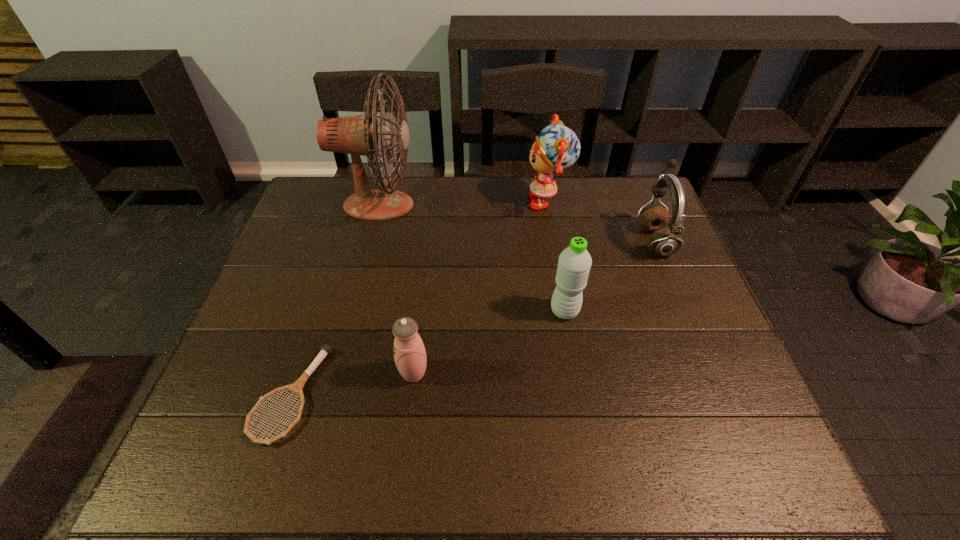
Identify the location of object at the near edge. (296, 387).

This screenshot has height=540, width=960. I want to click on fan at the left edge, so click(357, 135).

Locate an element on the screen. This screenshot has height=540, width=960. tennis racket that is positioned at the left edge is located at coordinates (296, 387).

You are a GUI agent. You are given a task and a screenshot of the screen. Output one action in this format:
    pyautogui.click(x=<x>, y=<y>)
    Task: Click on the object positioned at the right edge
    The width and height of the screenshot is (960, 540).
    Given the screenshot: What is the action you would take?
    pyautogui.click(x=663, y=242)

Find the location of a particular element. This screenshot has width=960, height=540. object present at the far left corner is located at coordinates (357, 135).

This screenshot has height=540, width=960. In order to click on object present at the near left corner in this screenshot , I will do `click(296, 387)`.

This screenshot has height=540, width=960. Identify the location of object located at the far right corner. (663, 242).

Locate an element on the screen. blank space at the far edge of the desktop is located at coordinates (416, 197).

At what (x,y) coordinates should I click in order to perform the action: click on free space at the near edge of the desktop. Please return your answer as a coordinate pair (x, y). This screenshot has width=960, height=540. Looking at the image, I should click on (296, 435).

I want to click on vacant space at the left edge of the desktop, so click(302, 227).